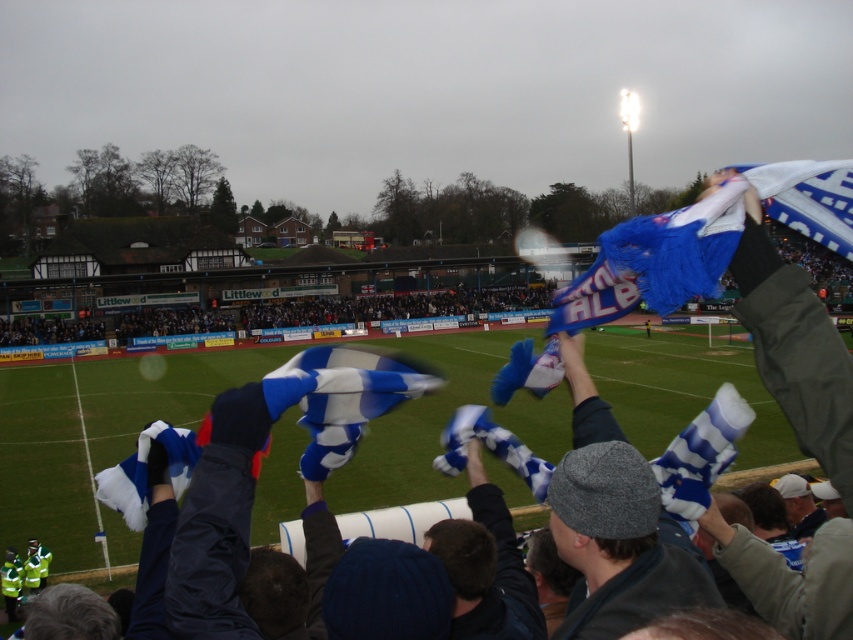
Question: Does blue and white striped scarf at upper right have a smaller size compared to blue and white fabric at upper center?

Choices:
 (A) no
 (B) yes

Answer: (B)

Question: Can you confirm if blue and white striped scarf at upper right is positioned below blue and white fabric at upper center?

Choices:
 (A) no
 (B) yes

Answer: (B)

Question: Considering the relative positions of blue and white striped scarf at upper right and blue and white fabric at upper center in the image provided, where is blue and white striped scarf at upper right located with respect to blue and white fabric at upper center?

Choices:
 (A) left
 (B) right

Answer: (B)

Question: Among these points, which one is nearest to the camera?

Choices:
 (A) (743, 173)
 (B) (694, 497)

Answer: (B)